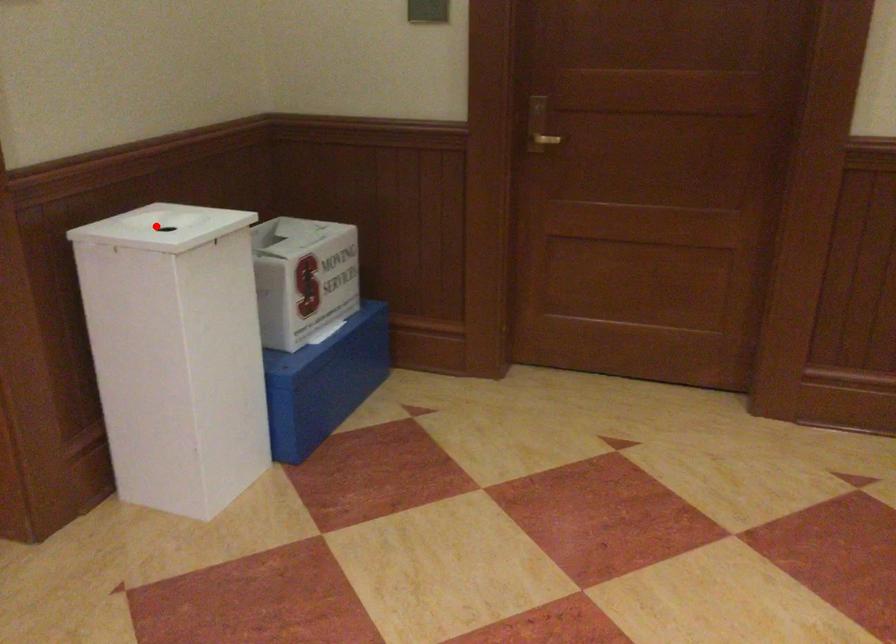
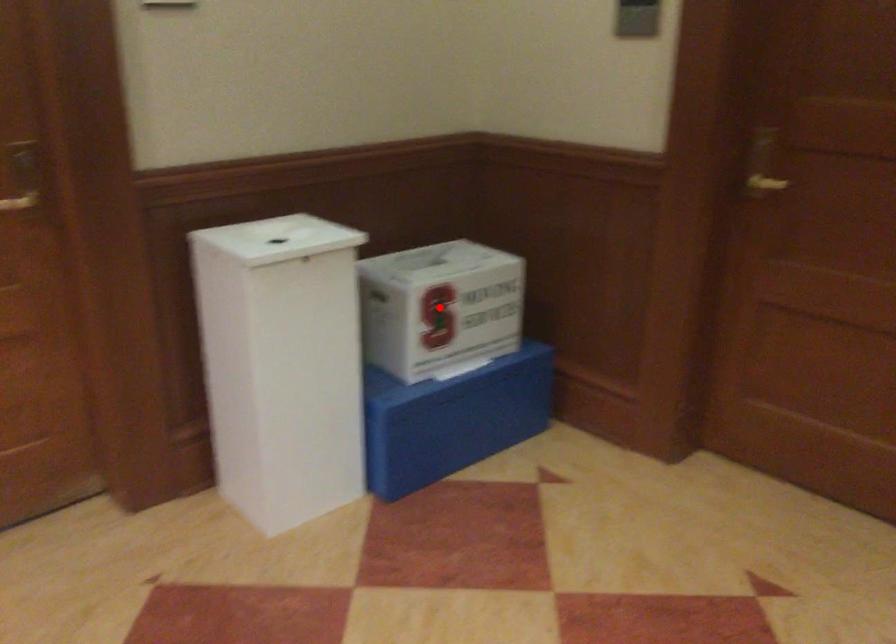
I am providing you with two images of the same scene from different viewpoints. A red point is marked on the first image and another point is marked on the second image. Do the highlighted points in image1 and image2 indicate the same real-world spot?

No